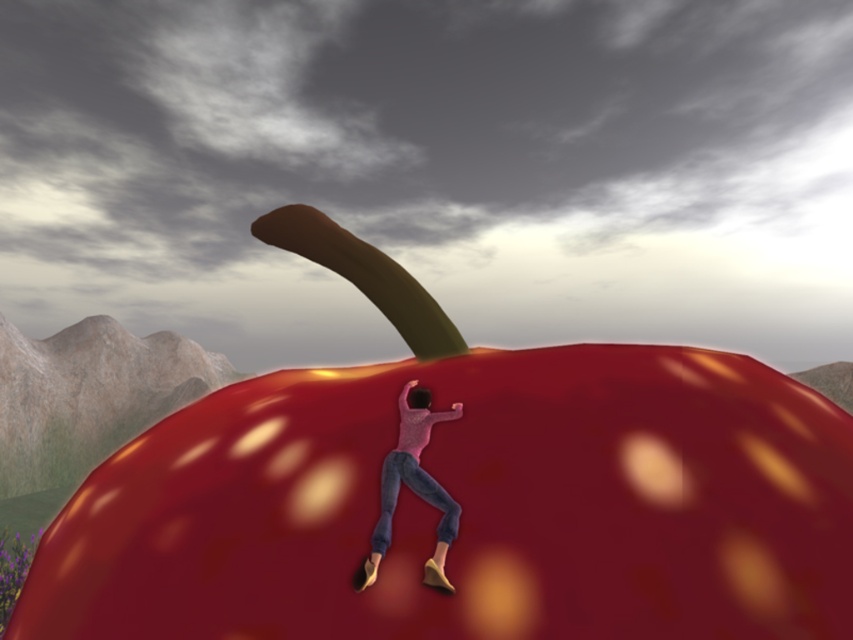
You are trying to decide which object to grab first while climbing the strawberry. The glossy red apple at center and the matte pink sweater at center are both in your reach. Which one is wider so you can grab it more easily?

The glossy red apple at center is wider than the matte pink sweater at center, so you can grab it more easily.

You are an observer standing in front of the surreal scene. You notice the glossy red apple at center and the matte pink sweater at center. Which object appears taller in the image?

The glossy red apple at center is much taller than the matte pink sweater at center.